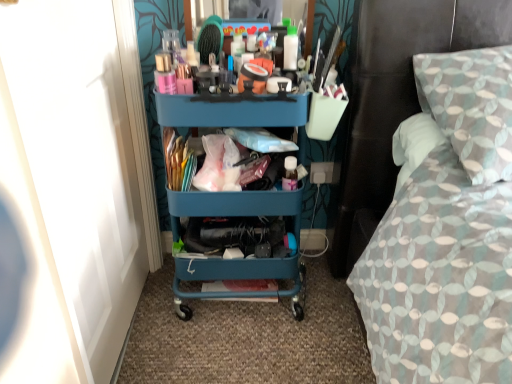
The image size is (512, 384). I want to click on vacant location below teal plastic cart at center (from a real-world perspective), so click(240, 302).